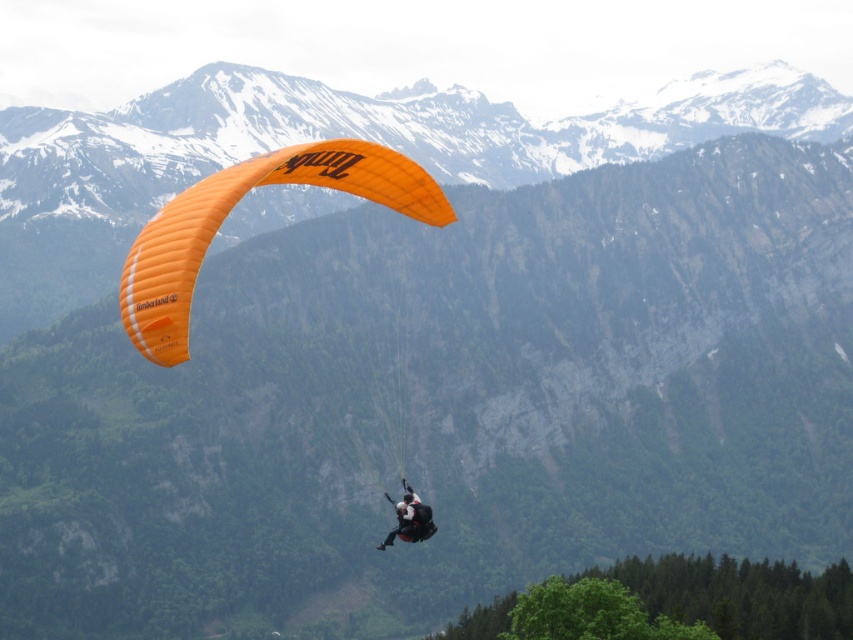
Does orange fabric parachute at center have a larger size compared to black fabric parachute at center?

Yes.

Find the location of a particular element. orange fabric parachute at center is located at coordinates (231, 209).

Who is more forward, (430, 195) or (387, 536)?

Point (387, 536) is in front.

At what (x,y) coordinates should I click in order to perform the action: click on orange fabric parachute at center. Please return your answer as a coordinate pair (x, y). Image resolution: width=853 pixels, height=640 pixels. Looking at the image, I should click on (231, 209).